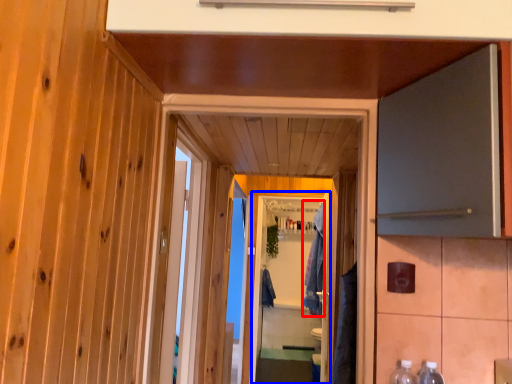
Question: Which object is further to the camera taking this photo, robe (highlighted by a red box) or screen door (highlighted by a blue box)?

Choices:
 (A) robe
 (B) screen door

Answer: (B)